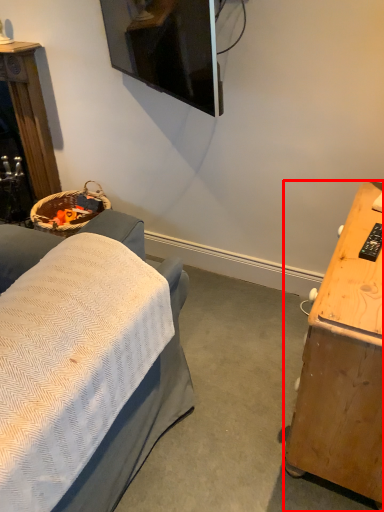
Question: From the image's perspective, where is desk (annotated by the red box) located in relation to furniture in the image?

Choices:
 (A) above
 (B) below

Answer: (B)